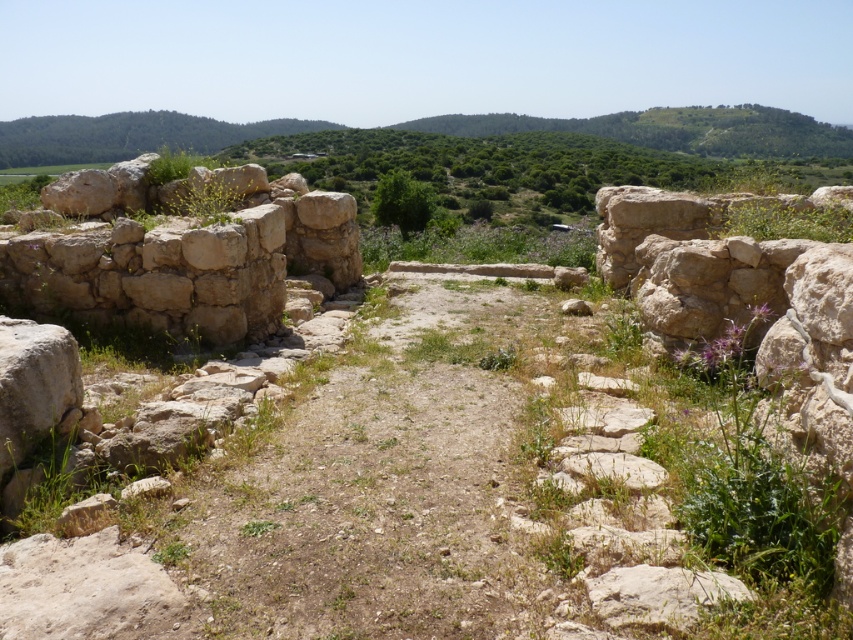
You are an archaeologist standing at the beige rough stone wall at left. You want to walk to the dirt path at center. Which direction should you move to reach it?

The dirt path at center is to the right of the beige rough stone wall at left, so you should move to your right to reach it.

You are an archaeologist examining the site. You need to determine which area is larger in the image between the dirt path at center and the beige rough stone wall at left. Which one occupies more space?

The beige rough stone wall at left occupies more space than the dirt path at center according to the description.

You are an archaeologist standing at the archaeological site. You notice two points marked in the image. Which point, point [274,596] or point [132,170], is closer to you?

Point [274,596] is closer to the viewer than point [132,170].